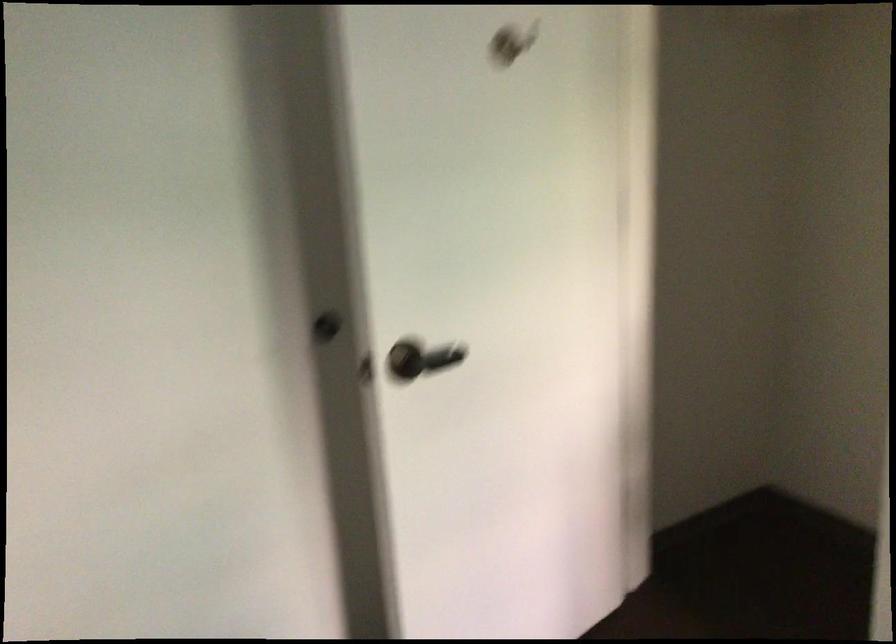
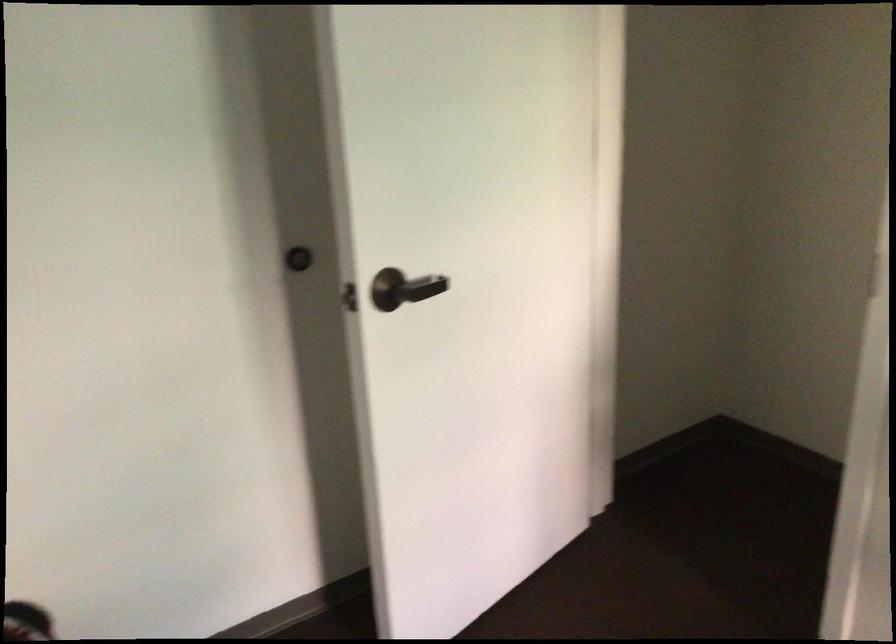
Question: The first image is from the beginning of the video and the second image is from the end. How did the camera likely rotate when shooting the video?

Choices:
 (A) Left
 (B) Right
 (C) Up
 (D) Down

Answer: (B)